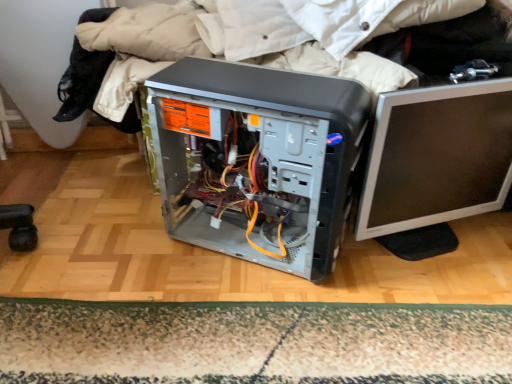
Describe the element at coordinates (252, 342) in the screenshot. I see `carpeted mat at lower center` at that location.

What do you see at coordinates (258, 160) in the screenshot? This screenshot has height=384, width=512. I see `satin black computer tower at center` at bounding box center [258, 160].

Locate an element on the screen. The width and height of the screenshot is (512, 384). carpeted mat at lower center is located at coordinates (252, 342).

Which object is wider, satin black computer tower at center or carpeted mat at lower center?

satin black computer tower at center is wider.

Does satin black computer tower at center contain carpeted mat at lower center?

No, carpeted mat at lower center is not surrounded by satin black computer tower at center.

From the picture: Considering the relative sizes of satin black computer tower at center and carpeted mat at lower center in the image provided, is satin black computer tower at center shorter than carpeted mat at lower center?

In fact, satin black computer tower at center may be taller than carpeted mat at lower center.

From the picture: Considering the relative positions of satin black computer tower at center and carpeted mat at lower center in the image provided, is satin black computer tower at center to the left of carpeted mat at lower center from the viewer's perspective?

Incorrect, satin black computer tower at center is not on the left side of carpeted mat at lower center.

Which object is further away from the camera, silver/black plastic monitor at right or carpeted mat at lower center?

carpeted mat at lower center is more distant.

In terms of width, does silver/black plastic monitor at right look wider or thinner when compared to carpeted mat at lower center?

silver/black plastic monitor at right is thinner than carpeted mat at lower center.

Who is bigger, silver/black plastic monitor at right or carpeted mat at lower center?

Bigger between the two is silver/black plastic monitor at right.

Considering the relative sizes of satin black computer tower at center and silver/black plastic monitor at right in the image provided, is satin black computer tower at center shorter than silver/black plastic monitor at right?

Incorrect, the height of satin black computer tower at center does not fall short of that of silver/black plastic monitor at right.

From the image's perspective, does satin black computer tower at center appear higher than silver/black plastic monitor at right?

No, from the image's perspective, satin black computer tower at center is not over silver/black plastic monitor at right.

Considering the relative sizes of satin black computer tower at center and silver/black plastic monitor at right in the image provided, is satin black computer tower at center wider than silver/black plastic monitor at right?

Yes, satin black computer tower at center is wider than silver/black plastic monitor at right.

Consider the image. From a real-world perspective, who is located lower, satin black computer tower at center or silver/black plastic monitor at right?

silver/black plastic monitor at right, from a real-world perspective.

Would you say satin black computer tower at center is part of silver/black plastic monitor at right's contents?

No, satin black computer tower at center is not inside silver/black plastic monitor at right.

At what (x,y) coordinates should I click in order to perform the action: click on computer monitor below the satin black computer tower at center (from a real-world perspective). Please return your answer as a coordinate pair (x, y). The image size is (512, 384). Looking at the image, I should click on coord(436,164).

From a real-world perspective, is silver/black plastic monitor at right above or below satin black computer tower at center?

Clearly, from a real-world perspective, silver/black plastic monitor at right is below satin black computer tower at center.

Which is behind, silver/black plastic monitor at right or satin black computer tower at center?

silver/black plastic monitor at right.

Does carpeted mat at lower center have a larger size compared to satin black computer tower at center?

Incorrect, carpeted mat at lower center is not larger than satin black computer tower at center.

Does carpeted mat at lower center come in front of satin black computer tower at center?

No, the depth of carpeted mat at lower center is greater than that of satin black computer tower at center.

Is carpeted mat at lower center outside of satin black computer tower at center?

Yes, carpeted mat at lower center is outside of satin black computer tower at center.

Can you confirm if carpeted mat at lower center is smaller than silver/black plastic monitor at right?

Indeed, carpeted mat at lower center has a smaller size compared to silver/black plastic monitor at right.

From a real-world perspective, who is located lower, carpeted mat at lower center or silver/black plastic monitor at right?

carpeted mat at lower center, from a real-world perspective.

Are carpeted mat at lower center and silver/black plastic monitor at right beside each other?

There is a gap between carpeted mat at lower center and silver/black plastic monitor at right.

Between carpeted mat at lower center and silver/black plastic monitor at right, which one has more height?

With more height is silver/black plastic monitor at right.

Where is `computer tower above the carpeted mat at lower center (from the image's perspective)`? computer tower above the carpeted mat at lower center (from the image's perspective) is located at coordinates (258, 160).

Where is `mat on the left of the silver/black plastic monitor at right`? The height and width of the screenshot is (384, 512). mat on the left of the silver/black plastic monitor at right is located at coordinates (252, 342).

Considering their positions, is silver/black plastic monitor at right positioned further to satin black computer tower at center than carpeted mat at lower center?

carpeted mat at lower center is positioned further to the anchor satin black computer tower at center.

Estimate the real-world distances between objects in this image. Which object is closer to silver/black plastic monitor at right, carpeted mat at lower center or satin black computer tower at center?

satin black computer tower at center lies closer to silver/black plastic monitor at right than the other object.

From the image, which object appears to be farther from carpeted mat at lower center, silver/black plastic monitor at right or satin black computer tower at center?

silver/black plastic monitor at right is further to carpeted mat at lower center.

Considering their positions, is carpeted mat at lower center positioned further to satin black computer tower at center than silver/black plastic monitor at right?

The object further to satin black computer tower at center is carpeted mat at lower center.

Which object lies further to the anchor point carpeted mat at lower center, satin black computer tower at center or silver/black plastic monitor at right?

Based on the image, silver/black plastic monitor at right appears to be further to carpeted mat at lower center.

From the picture: Considering their positions, is satin black computer tower at center positioned closer to silver/black plastic monitor at right than carpeted mat at lower center?

satin black computer tower at center is closer to silver/black plastic monitor at right.

Find the location of `computer tower between carpeted mat at lower center and silver/black plastic monitor at right in the horizontal direction`. computer tower between carpeted mat at lower center and silver/black plastic monitor at right in the horizontal direction is located at coordinates (258, 160).